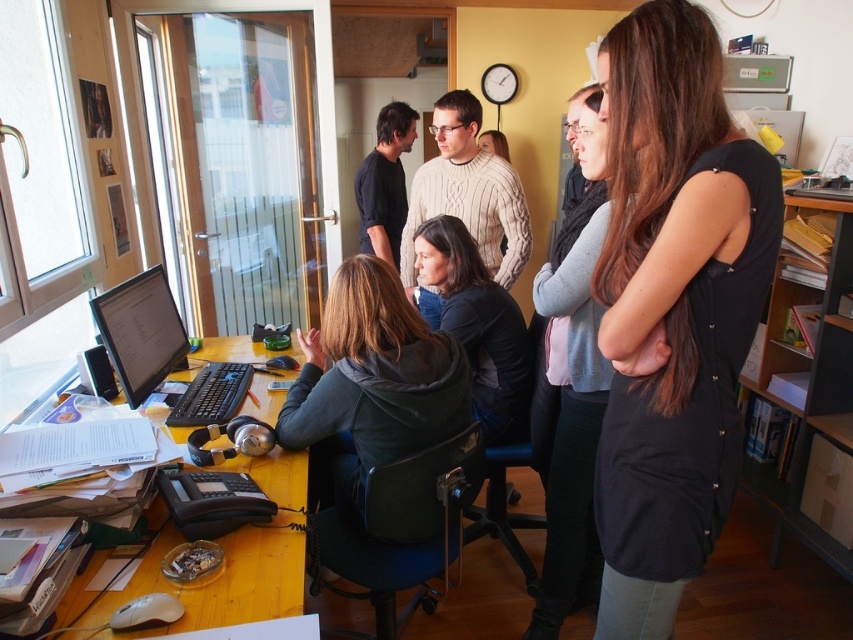
You are organizing a fashion show and need to display the black matte dress at right and the black matte jacket at center. Which item requires less space for proper display?

The black matte dress at right requires less space for proper display since it has a lesser width compared to the black matte jacket at center.

In the office scene, there are several items on the desk and people around it. Can you tell me what is located at the coordinate point [672,307]?

The coordinate point [672,307] indicates the location of the black matte dress at right.

You are standing in the office scene and want to determine which of the two points, point (325, 378) or point (494, 426), is closer to you. Based on the image, which point is nearer?

Point (325, 378) is closer to the camera than point (494, 426), so it is nearer to you.